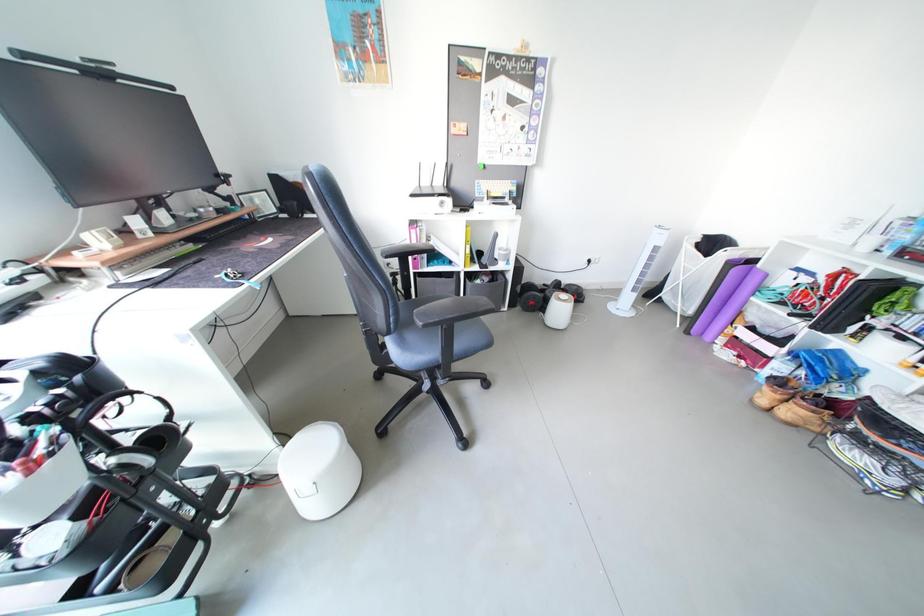
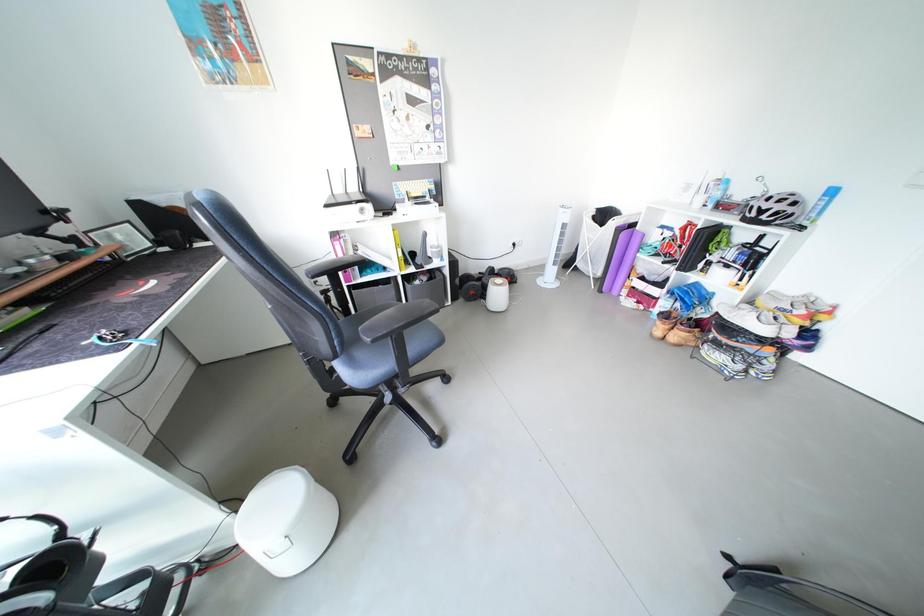
Question: The camera is either moving clockwise (left) or counter-clockwise (right) around the object. The first image is from the beginning of the video and the second image is from the end. Is the camera moving left or right when shooting the video?

Choices:
 (A) Left
 (B) Right

Answer: (A)